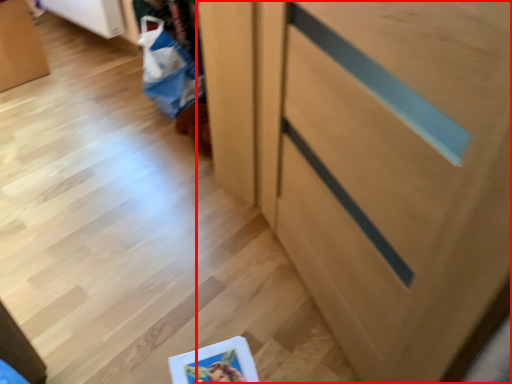
Question: From the image's perspective, considering the relative positions of cabinetry (annotated by the red box) and shopping bag in the image provided, where is cabinetry (annotated by the red box) located with respect to the staircase?

Choices:
 (A) below
 (B) above

Answer: (A)